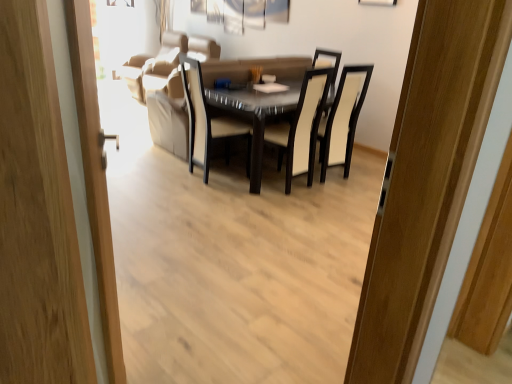
Question: Considering the relative positions of black leather chair at center, arranged as the 2th chair when viewed from the left, and wooden door at left in the image provided, is black leather chair at center, arranged as the 2th chair when viewed from the left, to the right of wooden door at left from the viewer's perspective?

Choices:
 (A) no
 (B) yes

Answer: (B)

Question: Is wooden door at left at the back of black leather chair at center, arranged as the 2th chair when viewed from the left?

Choices:
 (A) no
 (B) yes

Answer: (A)

Question: Considering the relative sizes of black leather chair at center, the first chair from the right, and wooden door at left in the image provided, is black leather chair at center, the first chair from the right, wider than wooden door at left?

Choices:
 (A) no
 (B) yes

Answer: (B)

Question: Is black leather chair at center, the first chair from the right, at the left side of wooden door at left?

Choices:
 (A) no
 (B) yes

Answer: (A)

Question: From a real-world perspective, is black leather chair at center, the first chair from the right, located beneath wooden door at left?

Choices:
 (A) no
 (B) yes

Answer: (B)

Question: From the image's perspective, is black leather chair at center, the first chair from the right, on top of wooden door at left?

Choices:
 (A) yes
 (B) no

Answer: (A)

Question: Is white fabric curtain at upper center not close to suede beige couch at upper center?

Choices:
 (A) yes
 (B) no

Answer: (B)

Question: Is white fabric curtain at upper center smaller than suede beige couch at upper center?

Choices:
 (A) yes
 (B) no

Answer: (A)

Question: Could you tell me if white fabric curtain at upper center is facing suede beige couch at upper center?

Choices:
 (A) yes
 (B) no

Answer: (B)

Question: Can you confirm if white fabric curtain at upper center is wider than suede beige couch at upper center?

Choices:
 (A) no
 (B) yes

Answer: (A)

Question: From a real-world perspective, does white fabric curtain at upper center sit lower than suede beige couch at upper center?

Choices:
 (A) no
 (B) yes

Answer: (A)

Question: Is white fabric curtain at upper center facing away from suede beige couch at upper center?

Choices:
 (A) no
 (B) yes

Answer: (A)

Question: From the image's perspective, is glossy glass table at center located beneath black leather chair at center, arranged as the 2th chair when viewed from the left?

Choices:
 (A) no
 (B) yes

Answer: (B)